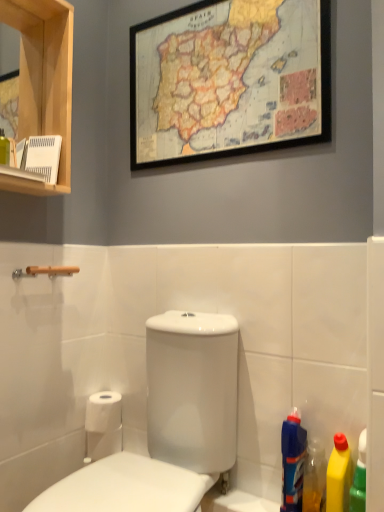
Question: Should I look upward or downward to see white glossy toilet at center?

Choices:
 (A) up
 (B) down

Answer: (B)

Question: Does white matte toilet paper at lower left have a smaller size compared to translucent plastic bottle at lower right, positioned as the 2th cleaning product in left-to-right order?

Choices:
 (A) no
 (B) yes

Answer: (A)

Question: Does white matte toilet paper at lower left touch translucent plastic bottle at lower right, positioned as the 2th cleaning product in left-to-right order?

Choices:
 (A) yes
 (B) no

Answer: (B)

Question: Are white matte toilet paper at lower left and translucent plastic bottle at lower right, which appears as the second cleaning product when viewed from the right, located far from each other?

Choices:
 (A) no
 (B) yes

Answer: (A)

Question: Does white matte toilet paper at lower left appear on the right side of translucent plastic bottle at lower right, which appears as the second cleaning product when viewed from the right?

Choices:
 (A) no
 (B) yes

Answer: (A)

Question: Can you confirm if white matte toilet paper at lower left is shorter than translucent plastic bottle at lower right, which appears as the second cleaning product when viewed from the right?

Choices:
 (A) yes
 (B) no

Answer: (A)

Question: From the image's perspective, is white matte toilet paper at lower left located beneath translucent plastic bottle at lower right, positioned as the 2th cleaning product in left-to-right order?

Choices:
 (A) no
 (B) yes

Answer: (B)

Question: Is blue plastic bottle at lower right, which ranks as the 3th cleaning product in right-to-left order, bigger than translucent plastic bottle at lower right, positioned as the 2th cleaning product in left-to-right order?

Choices:
 (A) no
 (B) yes

Answer: (B)

Question: Does blue plastic bottle at lower right, which ranks as the 3th cleaning product in right-to-left order, come behind translucent plastic bottle at lower right, positioned as the 2th cleaning product in left-to-right order?

Choices:
 (A) yes
 (B) no

Answer: (A)

Question: Is blue plastic bottle at lower right, which ranks as the 3th cleaning product in right-to-left order, positioned with its back to translucent plastic bottle at lower right, positioned as the 2th cleaning product in left-to-right order?

Choices:
 (A) yes
 (B) no

Answer: (B)

Question: Is the position of blue plastic bottle at lower right, acting as the 1th cleaning product starting from the left, less distant than that of translucent plastic bottle at lower right, which appears as the second cleaning product when viewed from the right?

Choices:
 (A) no
 (B) yes

Answer: (A)

Question: Is blue plastic bottle at lower right, which ranks as the 3th cleaning product in right-to-left order, not within translucent plastic bottle at lower right, which appears as the second cleaning product when viewed from the right?

Choices:
 (A) no
 (B) yes

Answer: (B)

Question: Is blue plastic bottle at lower right, acting as the 1th cleaning product starting from the left, oriented towards translucent plastic bottle at lower right, positioned as the 2th cleaning product in left-to-right order?

Choices:
 (A) no
 (B) yes

Answer: (A)

Question: Considering the relative positions of translucent plastic bottle at lower right, which appears as the second cleaning product when viewed from the right, and wooden-framed map at upper center in the image provided, is translucent plastic bottle at lower right, which appears as the second cleaning product when viewed from the right, in front of wooden-framed map at upper center?

Choices:
 (A) yes
 (B) no

Answer: (A)